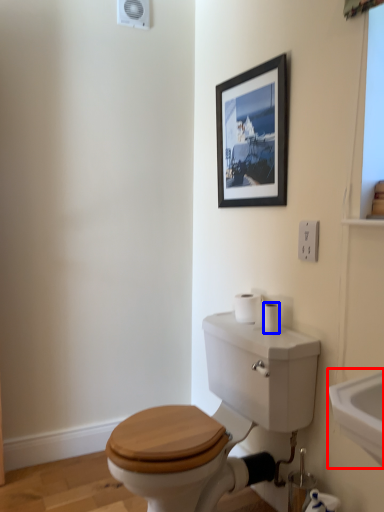
Question: Which point is further to the camera, sink (highlighted by a red box) or toilet paper (highlighted by a blue box)?

Choices:
 (A) sink
 (B) toilet paper

Answer: (B)